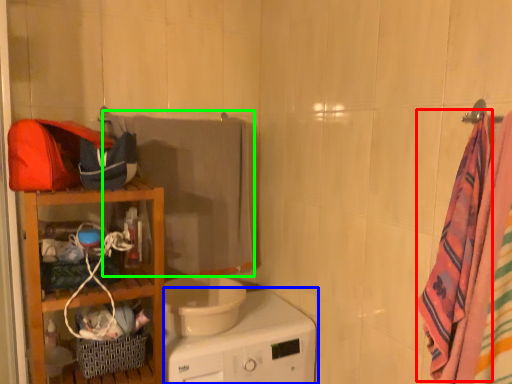
Question: Based on their relative distances, which object is nearer to beach towel (highlighted by a red box)? Choose from home appliance (highlighted by a blue box) and beach towel (highlighted by a green box).

Choices:
 (A) home appliance
 (B) beach towel

Answer: (A)